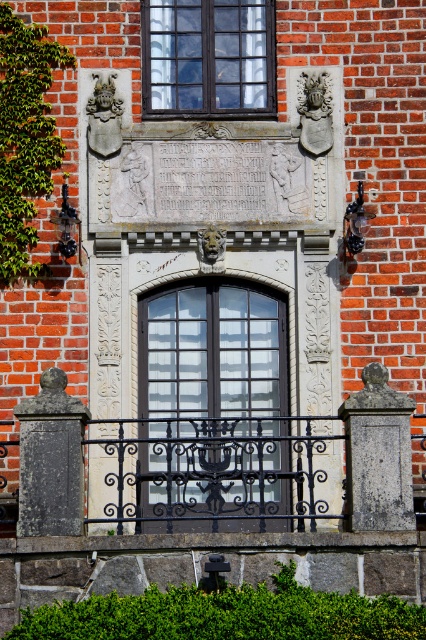
Question: Is green leafy ivy at left positioned at the back of carved stone figure at center?

Choices:
 (A) no
 (B) yes

Answer: (A)

Question: Which point is closer to the camera?

Choices:
 (A) matte black window at upper center
 (B) green leafy hedge at lower center
 (C) sandy stone lion at center

Answer: (B)

Question: Which point is closer to the camera taking this photo?

Choices:
 (A) (299, 93)
 (B) (132, 188)
 (C) (26, 636)
 (D) (216, 244)

Answer: (C)

Question: Observing the image, what is the correct spatial positioning of black wrought iron railing at center in reference to sandy stone lion at center?

Choices:
 (A) right
 (B) left

Answer: (A)

Question: Observing the image, what is the correct spatial positioning of matte black window at center in reference to stone carving at upper center?

Choices:
 (A) right
 (B) left

Answer: (B)

Question: Which object is positioned closest to the green leafy ivy at left?

Choices:
 (A) gray stone relief at center
 (B) matte black window at center

Answer: (A)